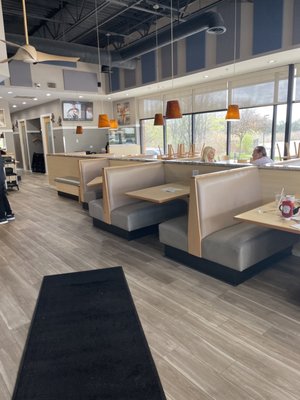
This screenshot has height=400, width=300. I want to click on restaurant booth, so click(233, 239), click(214, 201), click(170, 225), click(126, 211).